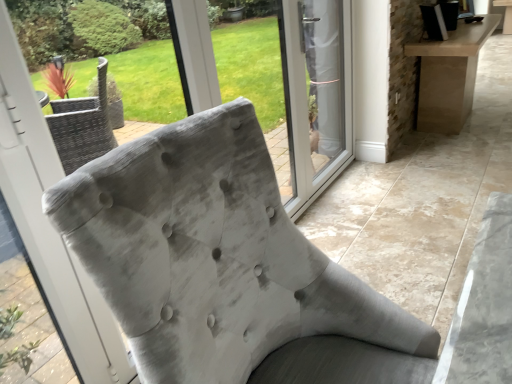
Question: Is velvet gray chair at center inside or outside of transparent glass door at center?

Choices:
 (A) inside
 (B) outside

Answer: (B)

Question: Is velvet gray chair at center bigger or smaller than transparent glass door at center?

Choices:
 (A) big
 (B) small

Answer: (A)

Question: Based on their positions, is velvet gray chair at center located to the left or right of transparent glass door at center?

Choices:
 (A) left
 (B) right

Answer: (A)

Question: Considering the positions of transparent glass door at center and velvet gray chair at center in the image, is transparent glass door at center wider or thinner than velvet gray chair at center?

Choices:
 (A) thin
 (B) wide

Answer: (A)

Question: Is transparent glass door at center bigger or smaller than velvet gray chair at center?

Choices:
 (A) small
 (B) big

Answer: (A)

Question: From the image's perspective, relative to velvet gray chair at center, is transparent glass door at center above or below?

Choices:
 (A) above
 (B) below

Answer: (A)

Question: In the image, is transparent glass door at center positioned in front of or behind velvet gray chair at center?

Choices:
 (A) behind
 (B) front

Answer: (A)